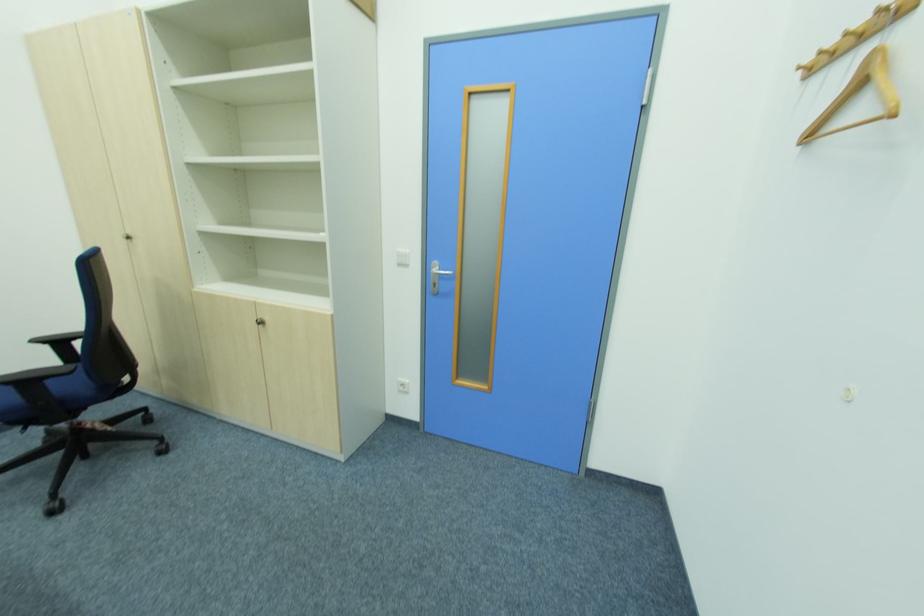
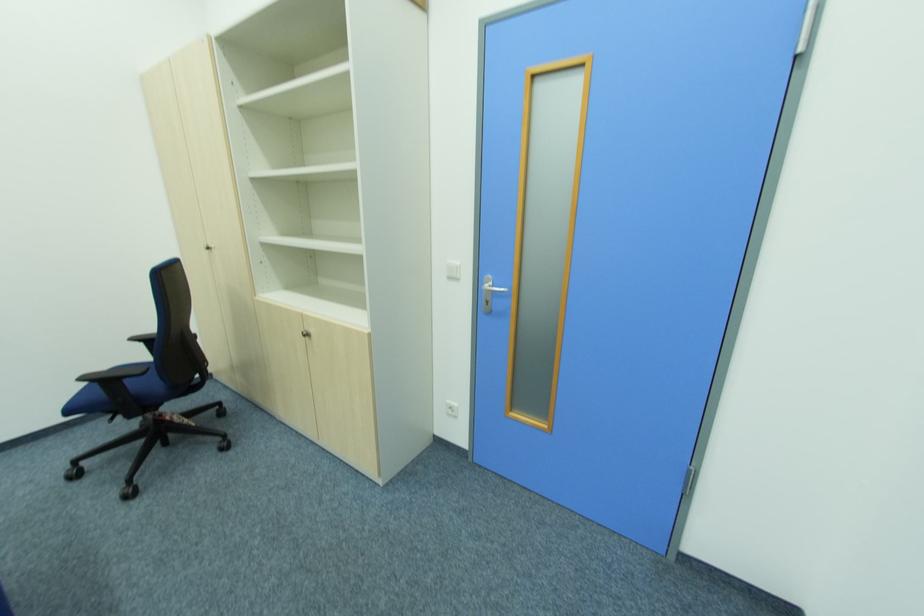
Question: The camera is either moving clockwise (left) or counter-clockwise (right) around the object. The first image is from the beginning of the video and the second image is from the end. Is the camera moving left or right when shooting the video?

Choices:
 (A) Left
 (B) Right

Answer: (B)